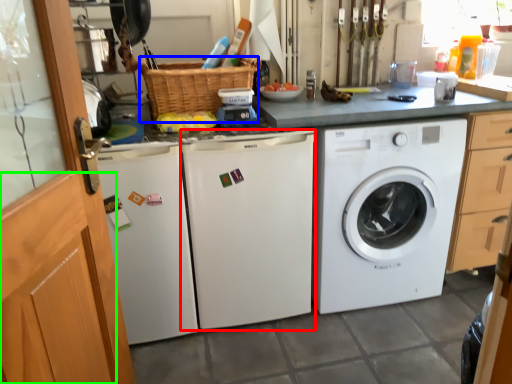
Question: Which object is positioned farthest from washing machine (highlighted by a red box)? Select from basket (highlighted by a blue box) and screen door (highlighted by a green box).

Choices:
 (A) basket
 (B) screen door

Answer: (B)